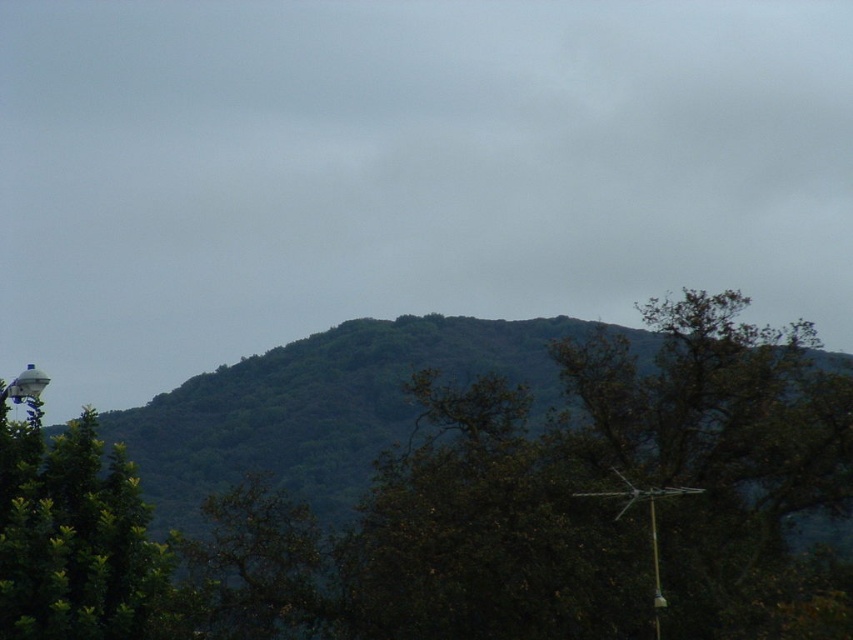
Question: Which object appears closest to the camera in this image?

Choices:
 (A) white plastic lamp post at lower left
 (B) green leafy tree at left
 (C) green leafy tree at center

Answer: (C)

Question: Can you confirm if green leafy tree at center is smaller than white plastic lamp post at lower left?

Choices:
 (A) no
 (B) yes

Answer: (B)

Question: Estimate the real-world distances between objects in this image. Which object is farther from the white plastic lamp post at lower left?

Choices:
 (A) green leafy tree at center
 (B) green leafy tree at left

Answer: (A)

Question: Can you confirm if green leafy tree at center is thinner than green leafy tree at left?

Choices:
 (A) no
 (B) yes

Answer: (B)

Question: Is green leafy tree at center positioned behind white plastic lamp post at lower left?

Choices:
 (A) no
 (B) yes

Answer: (A)

Question: Which object appears closest to the camera in this image?

Choices:
 (A) white plastic lamp post at lower left
 (B) green leafy tree at left

Answer: (B)